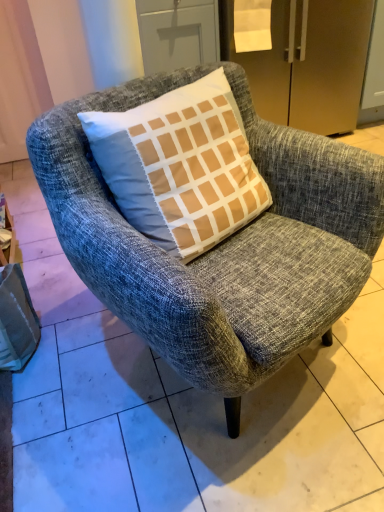
This screenshot has width=384, height=512. Describe the element at coordinates (221, 243) in the screenshot. I see `textured fabric armchair at center` at that location.

Locate an element on the screen. This screenshot has width=384, height=512. textured fabric armchair at center is located at coordinates (221, 243).

Find the location of a particular element. textured fabric armchair at center is located at coordinates (221, 243).